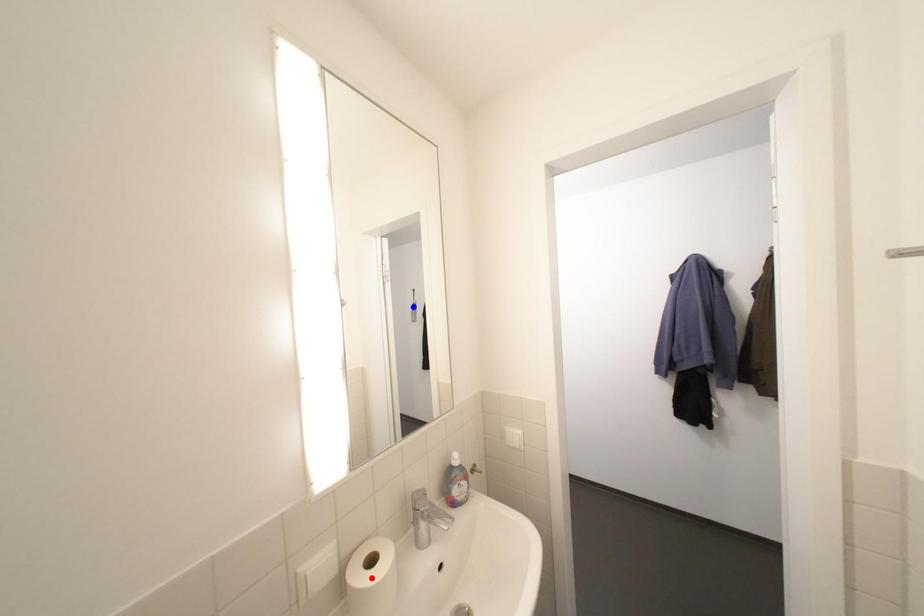
Question: In the image, two points are highlighted. Which point is nearer to the camera? Reply with the corresponding letter.

Choices:
 (A) blue point
 (B) red point

Answer: (B)